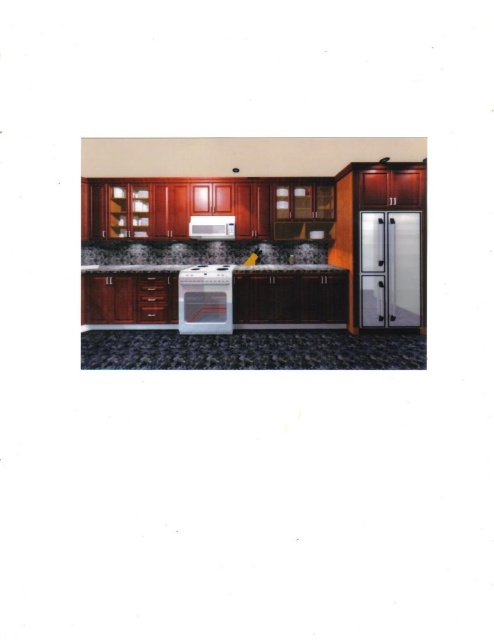
You are planning to place a new spice rack between the satin stainless steel refrigerator at right and the satin white microwave at center. Based on their positions, which appliance should the spice rack be closer to?

The spice rack should be placed closer to the satin white microwave at center because the refrigerator is positioned to the right of the microwave, so the microwave is to the left of the refrigerator. Therefore, placing the spice rack between them would mean it is closer to the microwave.

You are a chef preparing to place a hot dish on the counter. The granite countertop at center and the satin white microwave at center are in your view. Which surface should you use to avoid damaging the microwave?

You should use the granite countertop at center to place the hot dish because the satin white microwave at center is located to the right of it and is an appliance that shouldn